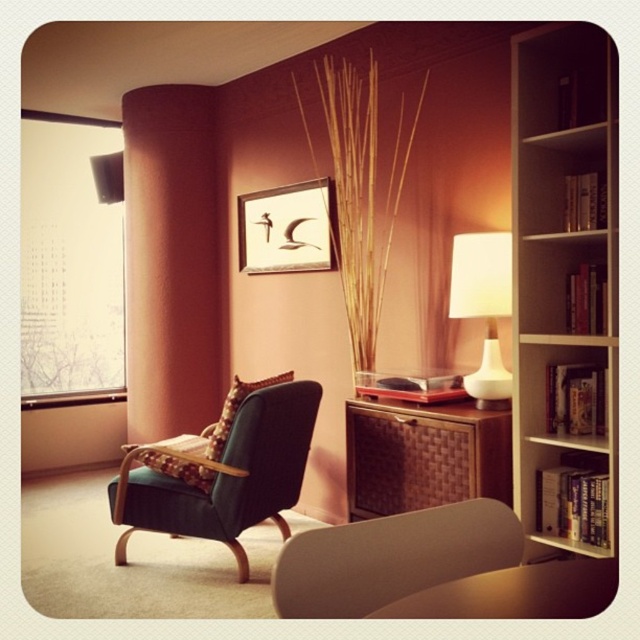
Question: Is velvet dark green armchair at center further to camera compared to white glossy lamp at right?

Choices:
 (A) yes
 (B) no

Answer: (A)

Question: Does white wood bookshelf at right appear on the right side of transparent glass window at left?

Choices:
 (A) yes
 (B) no

Answer: (A)

Question: Can you confirm if woven brown cabinet at center is thinner than matte wooden picture frame at upper center?

Choices:
 (A) yes
 (B) no

Answer: (B)

Question: Which point appears closest to the camera in this image?

Choices:
 (A) (348, 406)
 (B) (476, 525)

Answer: (B)

Question: Among these points, which one is nearest to the camera?

Choices:
 (A) (573, 257)
 (B) (216, 504)

Answer: (A)

Question: Based on their relative distances, which object is nearer to the transparent glass window at left?

Choices:
 (A) glossy wood table at lower center
 (B) white wood bookshelf at right

Answer: (B)